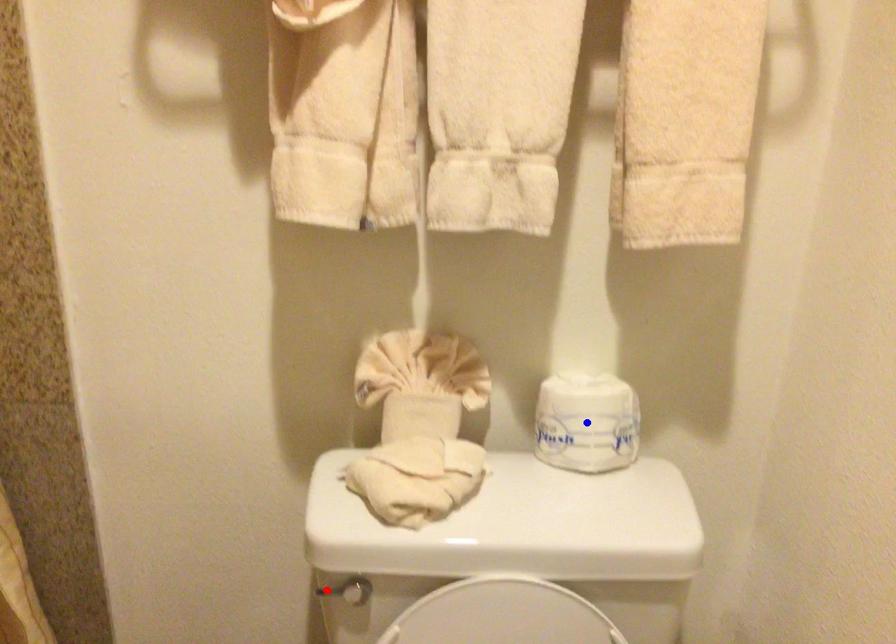
Question: In the image, two points are highlighted. Which point is nearer to the camera? Reply with the corresponding letter.

Choices:
 (A) blue point
 (B) red point

Answer: (B)